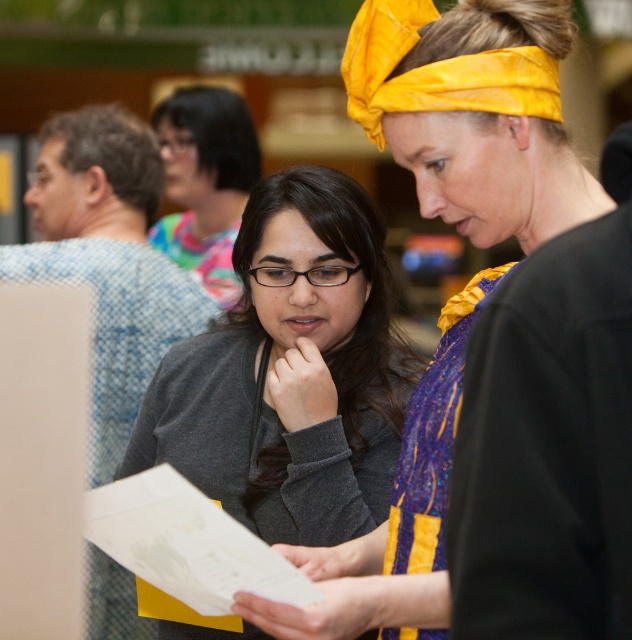
Question: Can you confirm if matte black sweater at center is thinner than yellow silky headscarf at upper center?

Choices:
 (A) no
 (B) yes

Answer: (A)

Question: Which point is closer to the camera?

Choices:
 (A) yellow silky headscarf at upper center
 (B) gray matte sweater at center

Answer: (A)

Question: Can you confirm if matte black sweater at center is smaller than gray matte sweater at center?

Choices:
 (A) yes
 (B) no

Answer: (B)

Question: Based on their relative distances, which object is nearer to the gray matte sweater at center?

Choices:
 (A) yellow silky headscarf at upper center
 (B) matte black sweater at center

Answer: (B)

Question: Does gray matte sweater at center appear on the left side of yellow silky headscarf at upper center?

Choices:
 (A) yes
 (B) no

Answer: (A)

Question: Which object is positioned farthest from the matte black sweater at center?

Choices:
 (A) gray matte sweater at center
 (B) yellow silky headscarf at upper center

Answer: (A)